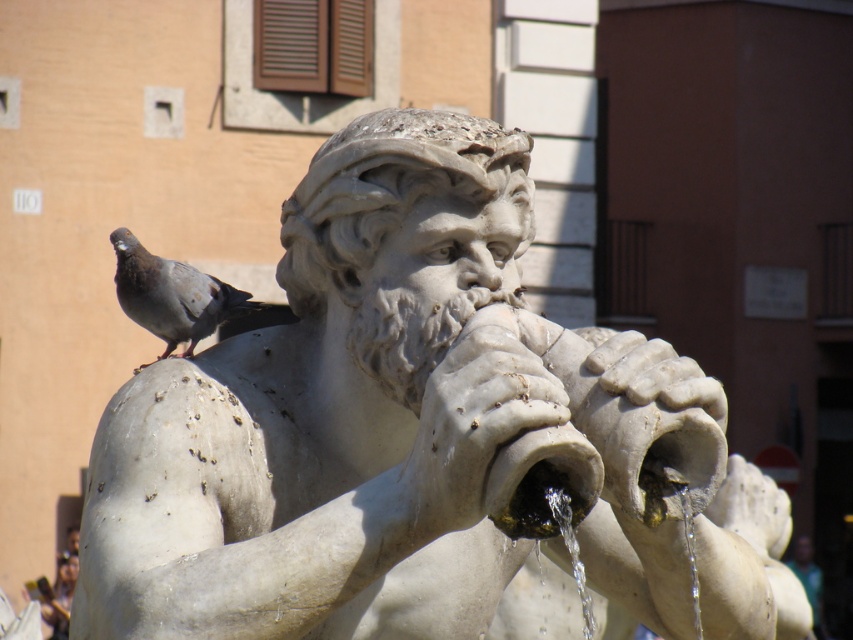
Question: Is white marble statue at center behind gray matte pigeon at upper left?

Choices:
 (A) no
 (B) yes

Answer: (A)

Question: Can you confirm if white marble statue at center is positioned to the right of gray matte pigeon at upper left?

Choices:
 (A) yes
 (B) no

Answer: (A)

Question: Which of the following is the closest to the observer?

Choices:
 (A) (262, 632)
 (B) (157, 282)

Answer: (A)

Question: Which of the following is the closest to the observer?

Choices:
 (A) gray matte pigeon at upper left
 (B) white marble statue at center

Answer: (B)

Question: Considering the relative positions of white marble statue at center and gray matte pigeon at upper left in the image provided, where is white marble statue at center located with respect to gray matte pigeon at upper left?

Choices:
 (A) below
 (B) above

Answer: (A)

Question: Which of the following is the farthest from the observer?

Choices:
 (A) (177, 266)
 (B) (204, 522)

Answer: (A)